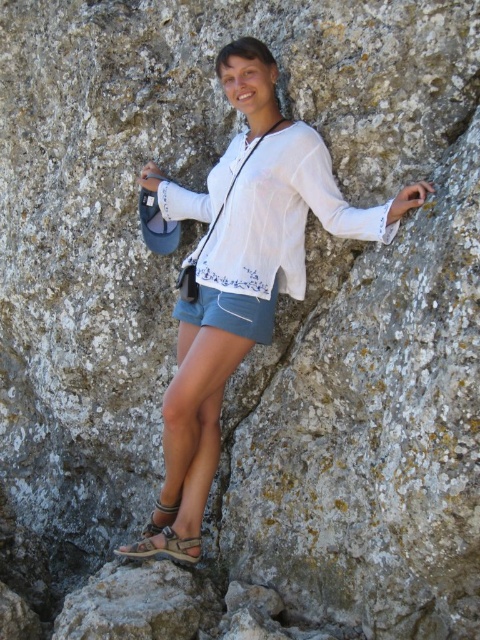
You are a photographer planning to take a portrait of the person in the scene. You need to ensure there is enough space between the matte white blouse at center and the brown leather sandal at lower center to avoid clutter in the photo. The minimum recommended distance between these items in portraits is 2 meters. Based on the scene description, will this setup work?

The matte white blouse at center and brown leather sandal at lower center are 2.48 meters apart from each other, which exceeds the minimum recommended distance of 2 meters. Therefore, this setup will work for the portrait to avoid clutter.

You are a photographer trying to capture the perfect shot of the person in the scene. You want to ensure that both the white sheer blouse at center and the brown leather sandal at lower center are clearly visible in the frame. Based on their positions, which object should you focus on first to ensure both are in focus?

You should focus on the white sheer blouse at center first because it is positioned to the right of the brown leather sandal at lower center, so adjusting focus starting from the blouse will help ensure both are in the frame and in focus.

You are navigating a rocky trail and need to place two markers at the coordinates provided. The first marker is at point [367,225], and the second at point [155,532]. Which marker will be closer to your current position if you are standing directly in front of the rock formation?

Point [367,225] is in front of point [155,532], so the first marker at point [367,225] will be closer to your current position when standing directly in front of the rock formation.